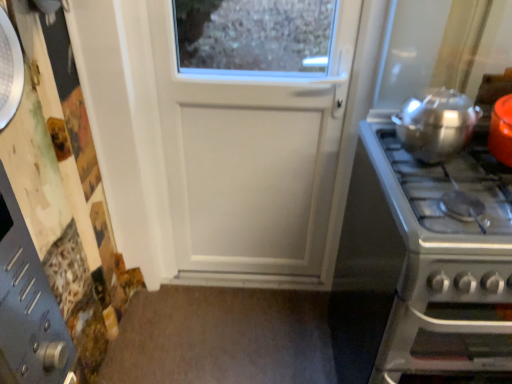
Question: Is satin silver gas stove at right at the left side of shiny metallic pot at right?

Choices:
 (A) no
 (B) yes

Answer: (A)

Question: From a real-world perspective, is satin silver gas stove at right beneath shiny metallic pot at right?

Choices:
 (A) yes
 (B) no

Answer: (A)

Question: Considering the relative positions of satin silver gas stove at right and shiny metallic pot at right in the image provided, is satin silver gas stove at right behind shiny metallic pot at right?

Choices:
 (A) no
 (B) yes

Answer: (A)

Question: From the image's perspective, is satin silver gas stove at right above shiny metallic pot at right?

Choices:
 (A) yes
 (B) no

Answer: (B)

Question: Does satin silver gas stove at right come in front of shiny metallic pot at right?

Choices:
 (A) no
 (B) yes

Answer: (B)

Question: Can you confirm if satin silver gas stove at right is taller than shiny metallic pot at right?

Choices:
 (A) no
 (B) yes

Answer: (B)

Question: Is shiny metallic pot at right touching satin silver gas stove at right?

Choices:
 (A) yes
 (B) no

Answer: (B)

Question: Considering the relative positions of shiny metallic pot at right and satin silver gas stove at right in the image provided, is shiny metallic pot at right in front of satin silver gas stove at right?

Choices:
 (A) yes
 (B) no

Answer: (B)

Question: Is shiny metallic pot at right taller than satin silver gas stove at right?

Choices:
 (A) no
 (B) yes

Answer: (A)

Question: Is shiny metallic pot at right looking in the opposite direction of satin silver gas stove at right?

Choices:
 (A) yes
 (B) no

Answer: (B)

Question: Does shiny metallic pot at right have a greater width compared to satin silver gas stove at right?

Choices:
 (A) no
 (B) yes

Answer: (A)

Question: Is shiny metallic pot at right further to the viewer compared to satin silver gas stove at right?

Choices:
 (A) no
 (B) yes

Answer: (B)

Question: Would you say satin silver gas stove at right is to the left or to the right of shiny metallic pot at right in the picture?

Choices:
 (A) left
 (B) right

Answer: (B)